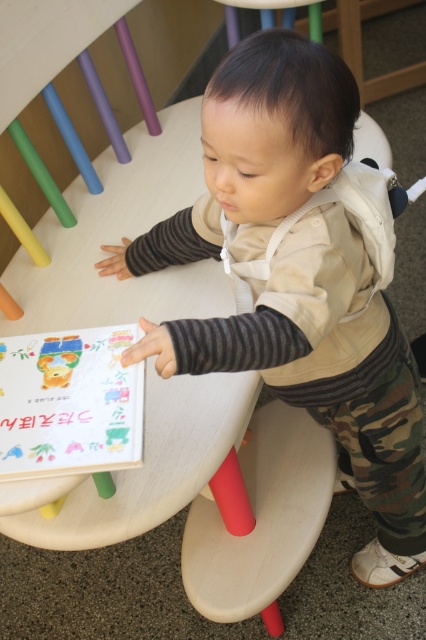
Question: Which of the following is the farthest from the observer?

Choices:
 (A) smooth wood stool at lower center
 (B) camouflage pants at lower right
 (C) matte plastic toy at lower left

Answer: (A)

Question: Which point appears closest to the camera in this image?

Choices:
 (A) (242, 132)
 (B) (40, 362)

Answer: (A)

Question: Can you confirm if smooth wood stool at lower center is positioned above matte plastic toy at lower left?

Choices:
 (A) yes
 (B) no

Answer: (B)

Question: Can you confirm if camouflage pants at lower right is smaller than smooth wood stool at lower center?

Choices:
 (A) no
 (B) yes

Answer: (A)

Question: Which object is positioned farthest from the matte plastic toy at lower left?

Choices:
 (A) smooth wood stool at lower center
 (B) camouflage pants at lower right

Answer: (A)

Question: From the image, what is the correct spatial relationship of camouflage pants at lower right in relation to matte plastic toy at lower left?

Choices:
 (A) left
 (B) right

Answer: (B)